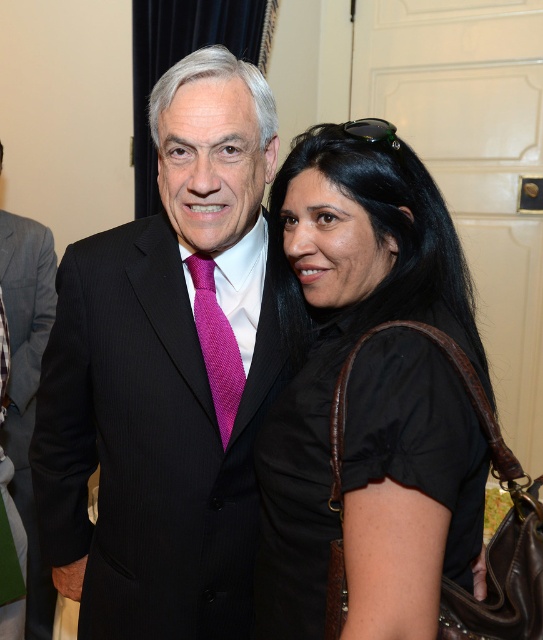
How far apart are black leather handbag at center and gray wool suit at left?

A distance of 1.51 meters exists between black leather handbag at center and gray wool suit at left.

Does black leather handbag at center appear on the right side of gray wool suit at left?

Indeed, black leather handbag at center is positioned on the right side of gray wool suit at left.

Is point (294, 618) positioned after point (40, 305)?

No, (294, 618) is in front of (40, 305).

Where is `black leather handbag at center`? The image size is (543, 640). black leather handbag at center is located at coordinates (343, 353).

Between black pinstripe suit at center and black leather handbag at center, which one appears on the left side from the viewer's perspective?

Positioned to the left is black pinstripe suit at center.

Who is shorter, black pinstripe suit at center or black leather handbag at center?

With less height is black leather handbag at center.

Which is behind, point (160, 349) or point (456, 305)?

The point (160, 349) is behind.

Locate an element on the screen. The height and width of the screenshot is (640, 543). black pinstripe suit at center is located at coordinates (167, 374).

Is black pinstripe suit at center closer to the viewer compared to pink textured tie at center?

Yes, it is in front of pink textured tie at center.

Is point (129, 387) positioned behind point (214, 349)?

No.

Locate an element on the screen. This screenshot has width=543, height=640. black pinstripe suit at center is located at coordinates (167, 374).